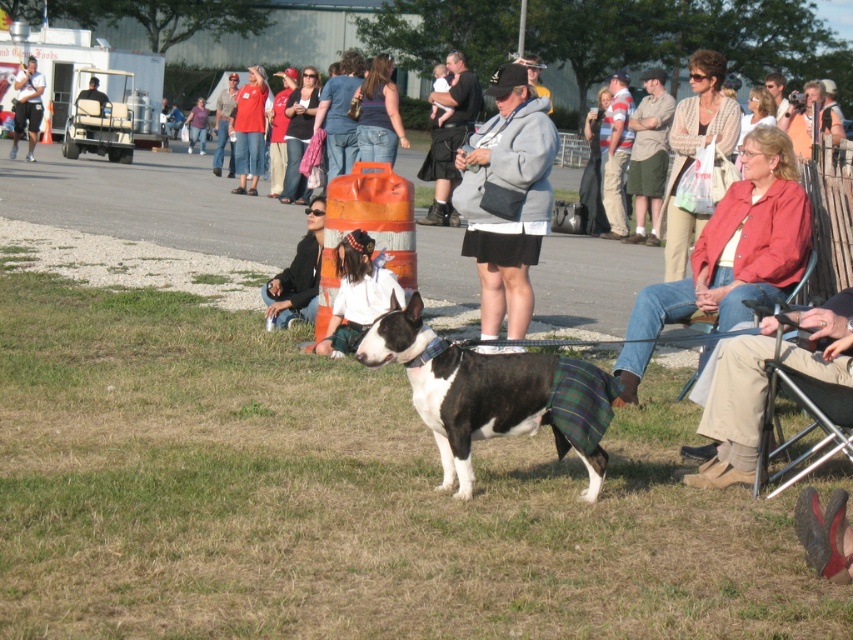
Is metallic silver folding chair at lower right positioned in front of striped cotton shirt at center?

Yes.

Is point (819, 408) closer to viewer compared to point (607, 196)?

Yes, it is.

Is point (756, 460) more distant than point (616, 136)?

No, it is not.

Find the location of a particular element. The width and height of the screenshot is (853, 640). metallic silver folding chair at lower right is located at coordinates (805, 426).

Does matte red jacket at right come in front of matte black t-shirt at upper left?

Yes, it is.

Who is shorter, matte red jacket at right or matte black t-shirt at upper left?

matte red jacket at right is shorter.

Who is more distant from viewer, [711,296] or [28,104]?

Positioned behind is point [28,104].

Find the location of a particular element. The height and width of the screenshot is (640, 853). matte red jacket at right is located at coordinates (730, 253).

Describe the element at coordinates (340, 499) in the screenshot. I see `green grass at center` at that location.

This screenshot has height=640, width=853. What are the coordinates of `green grass at center` in the screenshot? It's located at pyautogui.click(x=340, y=499).